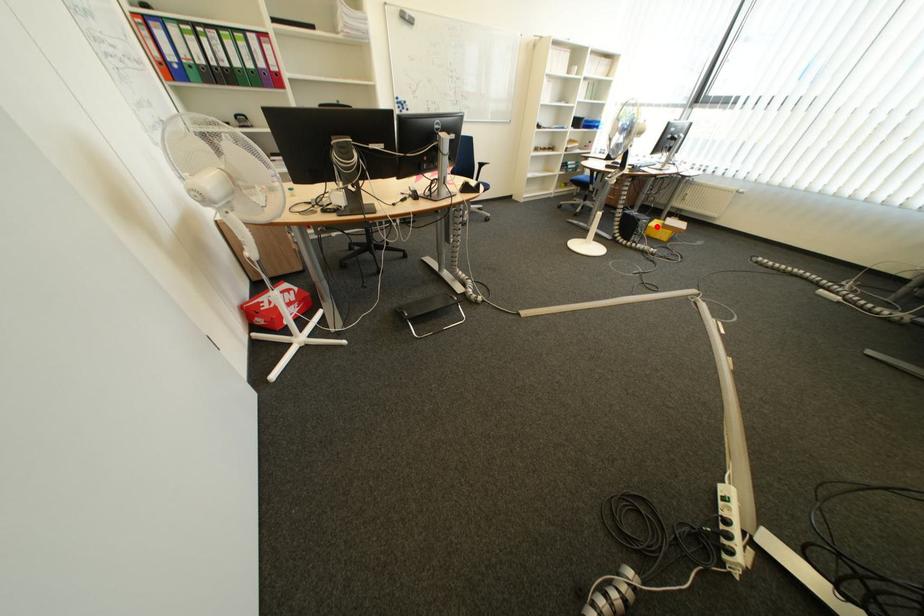
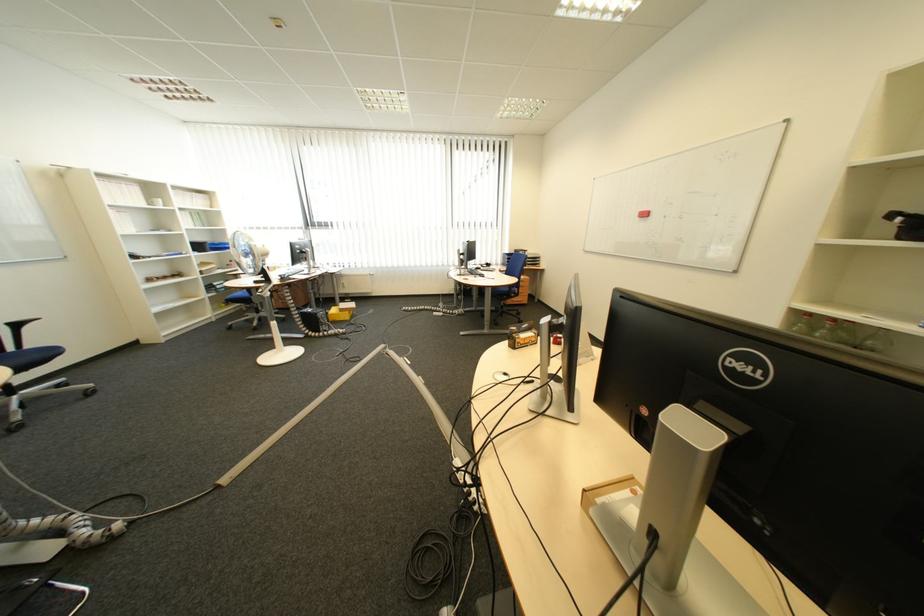
Question: I am providing you with two images of the same scene from different viewpoints. In image1, a red point is highlighted. Considering the same 3D point in image2, which of the following is correct?

Choices:
 (A) It is closer
 (B) It is farther

Answer: (A)